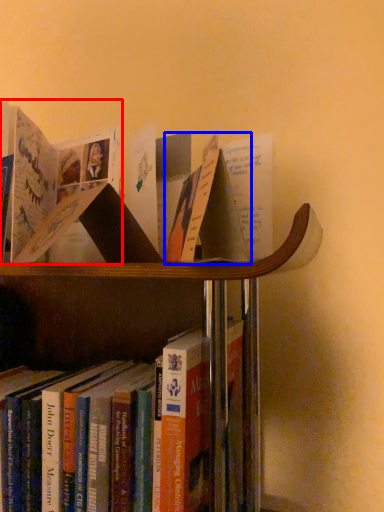
Question: Which object is further to the camera taking this photo, book (highlighted by a red box) or paperback book (highlighted by a blue box)?

Choices:
 (A) book
 (B) paperback book

Answer: (A)